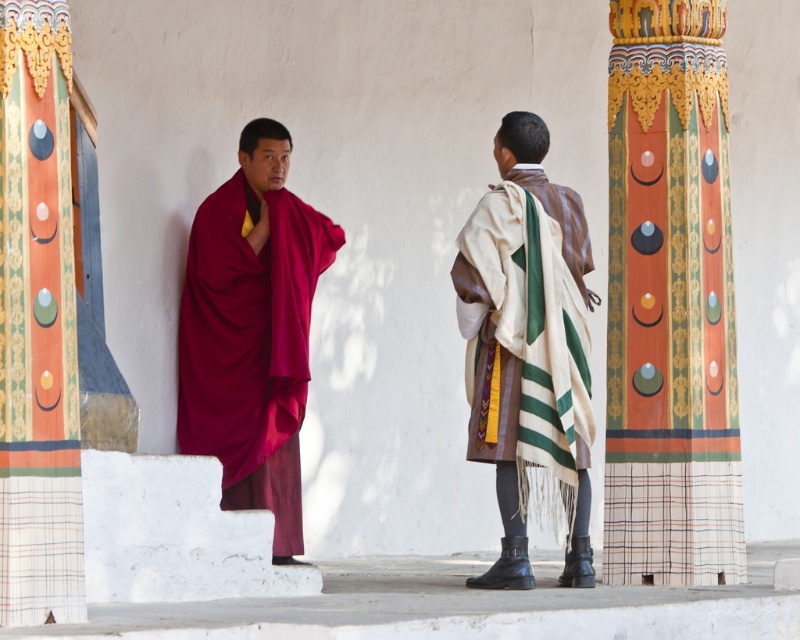
Question: Which is farther from the maroon silk robe at left?

Choices:
 (A) beige woven shawl at center
 (B) painted wood column at right

Answer: (B)

Question: Where is painted wood column at right located in relation to maroon silk robe at left in the image?

Choices:
 (A) left
 (B) right

Answer: (B)

Question: Is painted wood column at right wider than maroon silk robe at left?

Choices:
 (A) no
 (B) yes

Answer: (B)

Question: Does maroon silk robe at left have a greater width compared to beige woven shawl at center?

Choices:
 (A) no
 (B) yes

Answer: (B)

Question: Which object is closer to the camera taking this photo?

Choices:
 (A) beige woven shawl at center
 (B) maroon silk robe at left

Answer: (A)

Question: Which of the following is the farthest from the observer?

Choices:
 (A) (713, 3)
 (B) (466, 314)
 (C) (284, 532)

Answer: (C)